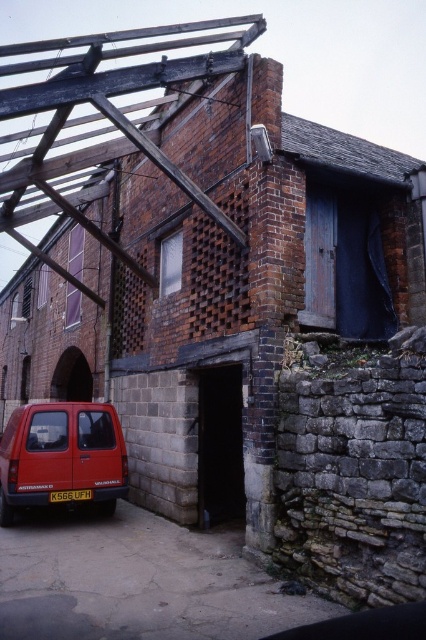
You are a delivery driver who needs to park your vehicle in front of the black stone door at lower center. The yellow plastic license plate at lower center is blocking the entrance. Can you drive through the space between them?

The black stone door at lower center is wider than the yellow plastic license plate at lower center, so you can drive through the space between them since the door is wider and provides enough clearance.

You are standing at the center of the image. Based on the coordinates provided, in which direction should you move to reach the matte red van at lower left?

Since the matte red van at lower left is located at coordinates point [60,454], you should move to the lower left direction to reach it.

You are a delivery driver who needs to enter the building through the black stone door at lower center. However, your vehicle is 2 meters wide. Can you drive through the door while carrying the yellow plastic license plate at lower center?

The black stone door at lower center is larger in size than the yellow plastic license plate at lower center, so the door is wide enough to allow the vehicle to pass through safely.